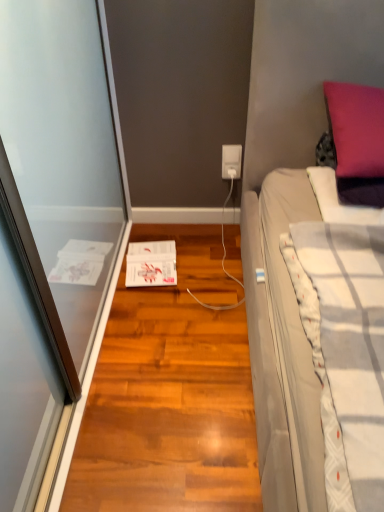
Question: Is shiny brown hardwood floor at center positioned in front of purple velvet pillow at upper right?

Choices:
 (A) yes
 (B) no

Answer: (A)

Question: From the image's perspective, is shiny brown hardwood floor at center located beneath purple velvet pillow at upper right?

Choices:
 (A) yes
 (B) no

Answer: (A)

Question: Is shiny brown hardwood floor at center aimed at purple velvet pillow at upper right?

Choices:
 (A) yes
 (B) no

Answer: (B)

Question: Is the position of shiny brown hardwood floor at center more distant than that of purple velvet pillow at upper right?

Choices:
 (A) yes
 (B) no

Answer: (B)

Question: From the image's perspective, does shiny brown hardwood floor at center appear higher than purple velvet pillow at upper right?

Choices:
 (A) no
 (B) yes

Answer: (A)

Question: From a real-world perspective, does shiny brown hardwood floor at center sit lower than purple velvet pillow at upper right?

Choices:
 (A) no
 (B) yes

Answer: (B)

Question: Would you say white textured blanket at right is outside shiny brown hardwood floor at center?

Choices:
 (A) no
 (B) yes

Answer: (B)

Question: Is white textured blanket at right surrounding shiny brown hardwood floor at center?

Choices:
 (A) yes
 (B) no

Answer: (B)

Question: Is white textured blanket at right looking in the opposite direction of shiny brown hardwood floor at center?

Choices:
 (A) yes
 (B) no

Answer: (B)

Question: Considering the relative sizes of white textured blanket at right and shiny brown hardwood floor at center in the image provided, is white textured blanket at right bigger than shiny brown hardwood floor at center?

Choices:
 (A) yes
 (B) no

Answer: (B)

Question: Does white textured blanket at right have a greater height compared to shiny brown hardwood floor at center?

Choices:
 (A) no
 (B) yes

Answer: (A)

Question: From a real-world perspective, is white textured blanket at right positioned under shiny brown hardwood floor at center based on gravity?

Choices:
 (A) no
 (B) yes

Answer: (A)

Question: Does white plastic power outlet at center turn towards shiny brown hardwood floor at center?

Choices:
 (A) no
 (B) yes

Answer: (B)